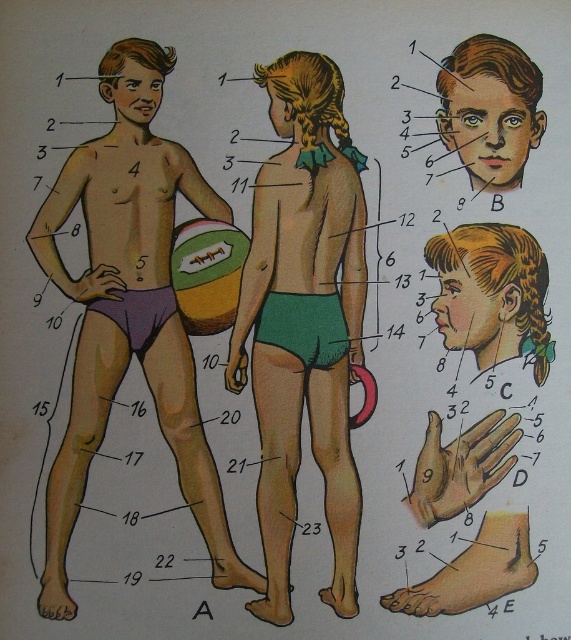
You are a student looking at the educational illustration of the human body. You see the green matte shorts at center and the matte brown hair at upper center. Which object is closer to you in the illustration?

The green matte shorts at center is in front of the matte brown hair at upper center, so the green matte shorts at center is closer to you.

You are a photographer standing in front of the smooth skin boy at center. If your camera has a minimum focusing distance of 1.5 meters, will you be able to take a clear photo of him?

The smooth skin boy at center is 1.36 meters away from the camera, which is closer than the minimum focusing distance of 1.5 meters. Therefore, the camera cannot focus properly, and the photo will be blurry.

You are a fashion designer observing the image of two children. You need to decide which garment to select for a size comparison. Which of the two garments, the green matte shorts at center or the purple matte underwear at lower left, is bigger in size?

The green matte shorts at center is larger in size compared to the purple matte underwear at lower left according to the description.